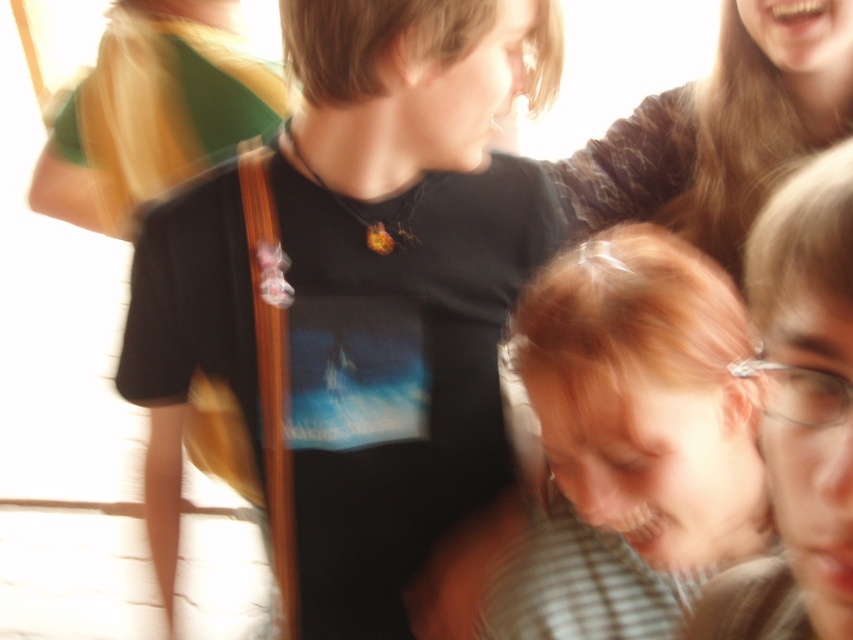
Is black t-shirt at center closer to camera compared to blonde hair at upper right?

Yes, black t-shirt at center is in front of blonde hair at upper right.

Is black t-shirt at center thinner than blonde hair at upper right?

Incorrect, black t-shirt at center's width is not less than blonde hair at upper right's.

Where is `black t-shirt at center`? black t-shirt at center is located at coordinates (357, 296).

Between black t-shirt at center and blonde hair at lower right, which one is positioned higher?

black t-shirt at center

Is black t-shirt at center to the right of blonde hair at lower right from the viewer's perspective?

Incorrect, black t-shirt at center is not on the right side of blonde hair at lower right.

Find the location of a particular element. The width and height of the screenshot is (853, 640). black t-shirt at center is located at coordinates (357, 296).

Between blonde hair at lower right and blonde hair at upper right, which one has more height?

blonde hair at lower right

Who is lower down, blonde hair at lower right or blonde hair at upper right?

Positioned lower is blonde hair at lower right.

Locate an element on the screen. blonde hair at lower right is located at coordinates (631, 440).

This screenshot has height=640, width=853. In order to click on blonde hair at lower right in this screenshot , I will do `click(631, 440)`.